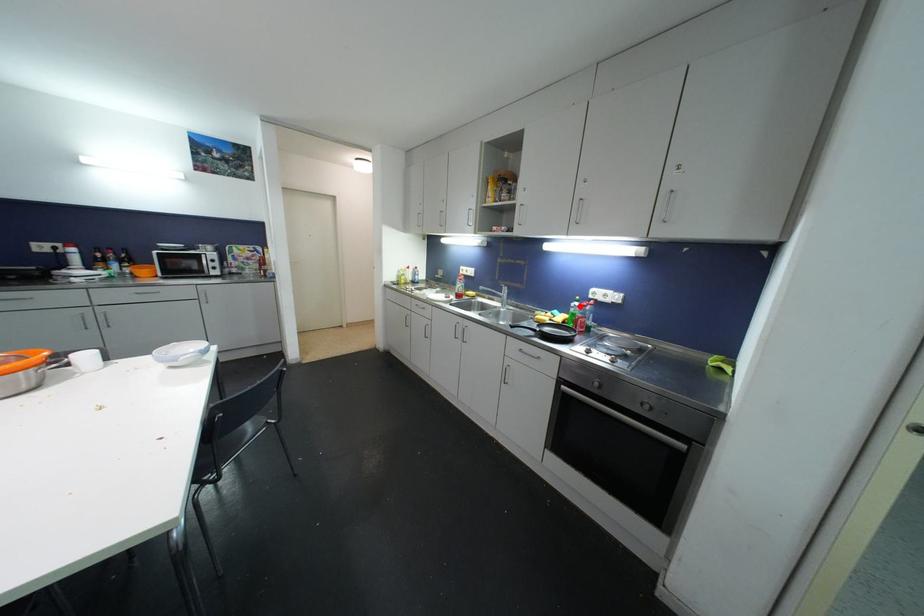
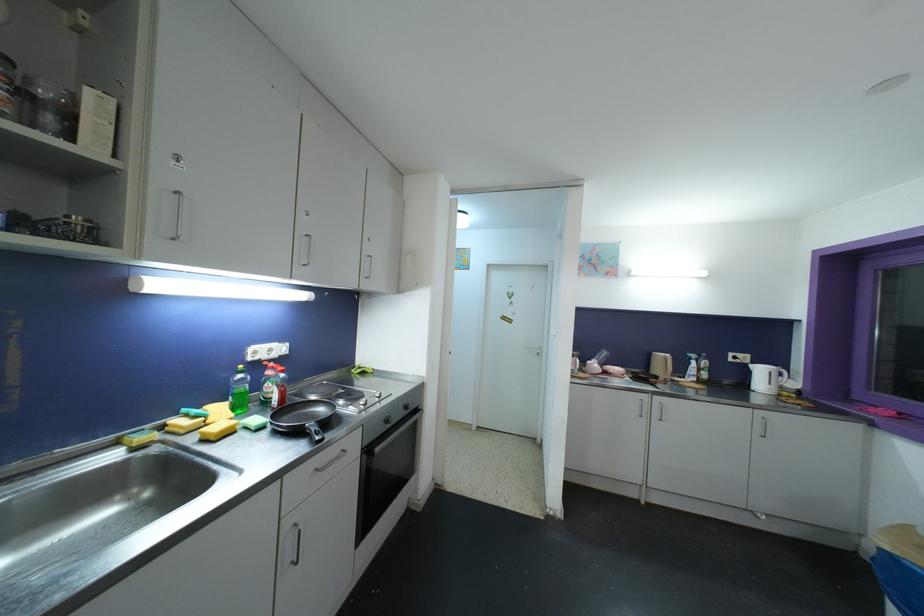
Question: A red point is marked in image1. In image2, is the corresponding 3D point closer to the camera or farther? Reply with the corresponding letter.

Choices:
 (A) The corresponding 3D point is closer.
 (B) The corresponding 3D point is farther.

Answer: (B)